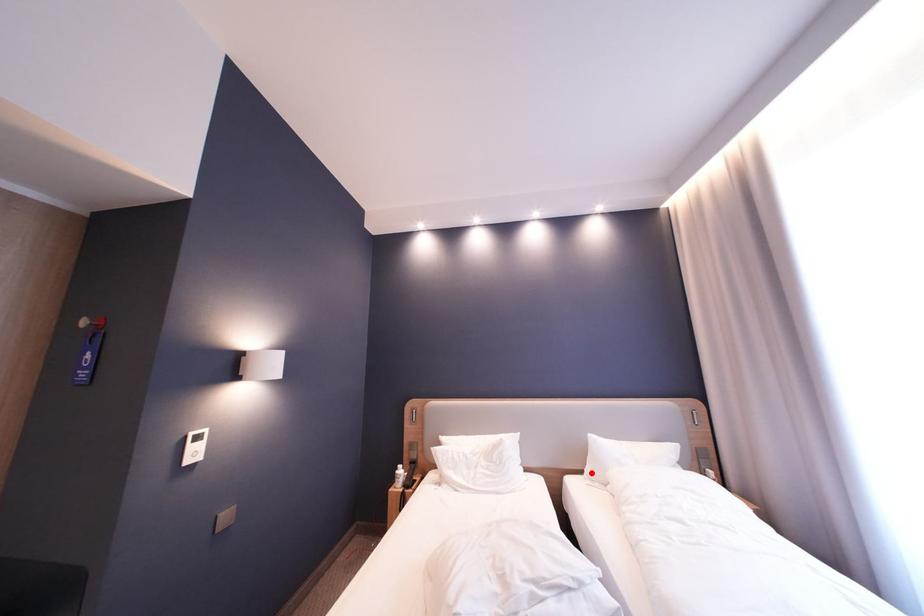
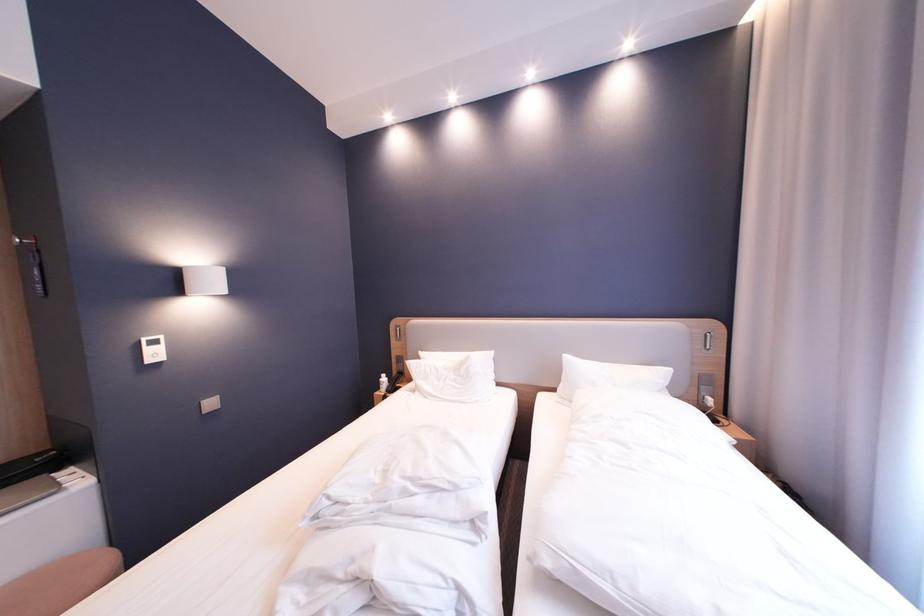
Question: I am providing you with two images of the same scene from different viewpoints. In image1, a red point is highlighted. Considering the same 3D point in image2, which of the following is correct?

Choices:
 (A) It is closer
 (B) It is farther

Answer: (A)